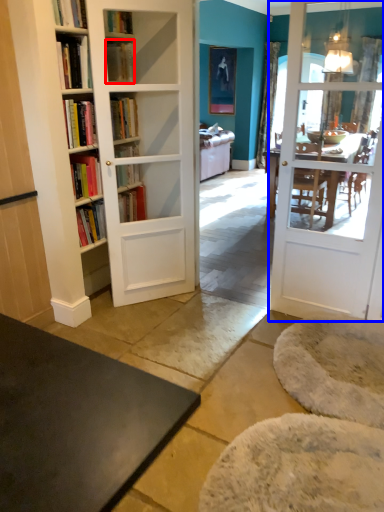
Question: Which of the following is the farthest to the observer, book (highlighted by a red box) or door (highlighted by a blue box)?

Choices:
 (A) book
 (B) door

Answer: (A)